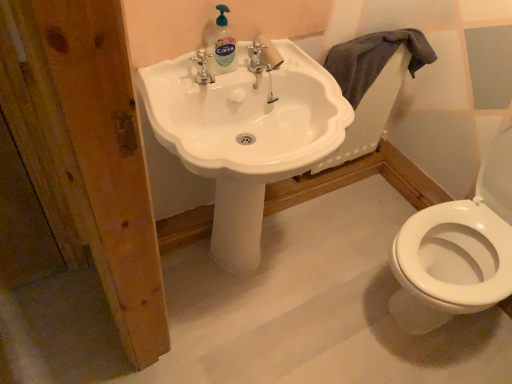
Question: From the image's perspective, would you say gray cotton towel at upper right is positioned over white glossy sink at center?

Choices:
 (A) yes
 (B) no

Answer: (A)

Question: Is gray cotton towel at upper right wider than white glossy sink at center?

Choices:
 (A) no
 (B) yes

Answer: (A)

Question: Can you confirm if gray cotton towel at upper right is taller than white glossy sink at center?

Choices:
 (A) yes
 (B) no

Answer: (B)

Question: Is white glossy sink at center located within gray cotton towel at upper right?

Choices:
 (A) no
 (B) yes

Answer: (A)

Question: Can you confirm if gray cotton towel at upper right is smaller than white glossy sink at center?

Choices:
 (A) yes
 (B) no

Answer: (A)

Question: Is point (225, 38) positioned closer to the camera than point (343, 119)?

Choices:
 (A) closer
 (B) farther

Answer: (B)

Question: Choose the correct answer: Is clear plastic bottle at upper center inside white glossy sink at center or outside it?

Choices:
 (A) outside
 (B) inside

Answer: (A)

Question: Looking at the image, does clear plastic bottle at upper center seem bigger or smaller compared to white glossy sink at center?

Choices:
 (A) big
 (B) small

Answer: (B)

Question: Considering their positions, is clear plastic bottle at upper center located in front of or behind white glossy sink at center?

Choices:
 (A) behind
 (B) front

Answer: (A)

Question: Based on their sizes in the image, would you say white glossy sink at center is bigger or smaller than clear plastic bottle at upper center?

Choices:
 (A) small
 (B) big

Answer: (B)

Question: Considering the positions of point [x=285, y=87] and point [x=215, y=33], is point [x=285, y=87] closer or farther from the camera than point [x=215, y=33]?

Choices:
 (A) closer
 (B) farther

Answer: (B)

Question: From a real-world perspective, is white glossy sink at center positioned above or below clear plastic bottle at upper center?

Choices:
 (A) above
 (B) below

Answer: (B)

Question: In terms of width, does white glossy sink at center look wider or thinner when compared to clear plastic bottle at upper center?

Choices:
 (A) wide
 (B) thin

Answer: (A)

Question: From the image's perspective, is white glossy sink at center positioned above or below gray cotton towel at upper right?

Choices:
 (A) above
 (B) below

Answer: (B)

Question: Is white glossy sink at center inside the boundaries of gray cotton towel at upper right, or outside?

Choices:
 (A) inside
 (B) outside

Answer: (B)